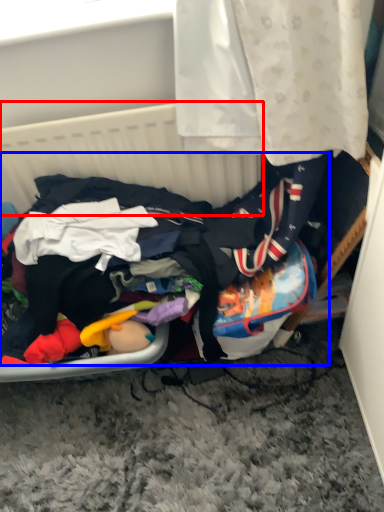
Question: Which object appears closest to the camera in this image, basket (highlighted by a red box) or clothing (highlighted by a blue box)?

Choices:
 (A) basket
 (B) clothing

Answer: (B)